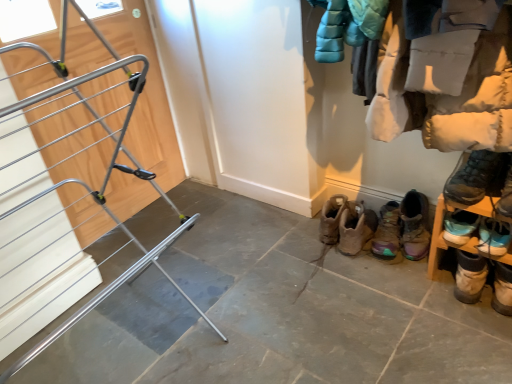
Question: From the image's perspective, relative to silver metallic drying rack at left, is brown suede boot at lower right, which is the 1th footwear from left to right, above or below?

Choices:
 (A) below
 (B) above

Answer: (A)

Question: In terms of height, does brown suede boot at lower right, which is the 1th footwear from left to right, look taller or shorter compared to silver metallic drying rack at left?

Choices:
 (A) short
 (B) tall

Answer: (A)

Question: Estimate the real-world distances between objects in this image. Which object is closer to the silver metallic drying rack at left?

Choices:
 (A) blue suede sneakers at lower right, marked as the 6th footwear in a left-to-right arrangement
 (B) white fluffy coat at upper right
 (C) wooden shoe rack at lower right
 (D) brown suede boot at lower right, which is counted as the sixth footwear, starting from the right
 (E) gray stone floor at center

Answer: (E)

Question: Estimate the real-world distances between objects in this image. Which object is closer to the brown suede boot at lower right, which is the 1th footwear from left to right?

Choices:
 (A) silver metallic drying rack at left
 (B) gray stone floor at center
 (C) white fluffy coat at upper right
 (D) wooden shoe rack at lower right
 (E) light brown suede boot at lower right, the 2th footwear in the right-to-left sequence

Answer: (D)